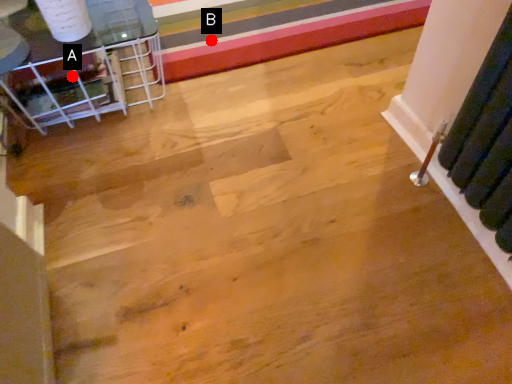
Question: Two points are circled on the image, labeled by A and B beside each circle. Which point is farther from the camera taking this photo?

Choices:
 (A) A is further
 (B) B is further

Answer: (B)